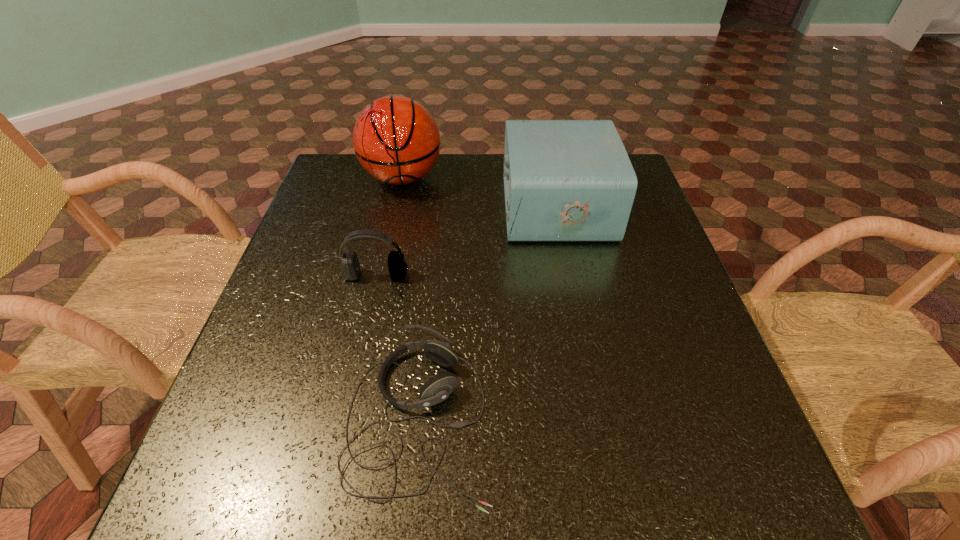
Where is `blank area in the image that satisfies the following two spatial constraints: 1. on the front panel of the radio receiver; 2. on the headband of the second nearest object`? The image size is (960, 540). blank area in the image that satisfies the following two spatial constraints: 1. on the front panel of the radio receiver; 2. on the headband of the second nearest object is located at coordinates (569, 275).